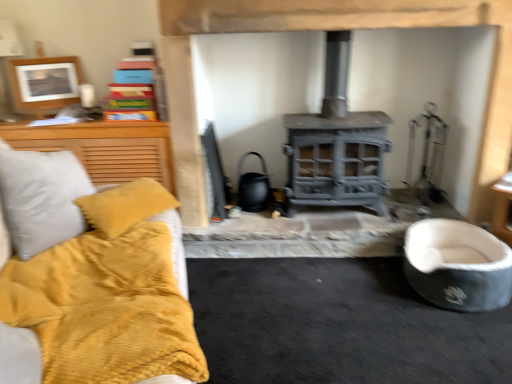
Measure the distance between point (404,1) and camera.

They are 2.08 meters apart.

Measure the distance between point (461,245) and camera.

7.42 feet.

Describe the element at coordinates (45, 83) in the screenshot. I see `wooden picture frame at upper left` at that location.

Image resolution: width=512 pixels, height=384 pixels. I want to click on gray metallic fireplace at center, so click(324, 30).

From the picture: Which point is more distant from viewer, (x=465, y=247) or (x=60, y=94)?

Positioned behind is point (x=60, y=94).

From a real-world perspective, is soft gray fabric pet bed at lower right positioned above or below wooden picture frame at upper left?

From a real-world perspective, soft gray fabric pet bed at lower right is physically below wooden picture frame at upper left.

Is soft gray fabric pet bed at lower right turned away from wooden picture frame at upper left?

soft gray fabric pet bed at lower right is not turned away from wooden picture frame at upper left.

From the image's perspective, is soft gray fabric pet bed at lower right under wooden picture frame at upper left?

Yes, from the image's perspective, soft gray fabric pet bed at lower right is below wooden picture frame at upper left.

Relative to gray metallic fireplace at center, is soft gray fabric pet bed at lower right in front or behind?

Visually, soft gray fabric pet bed at lower right is located in front of gray metallic fireplace at center.

Is soft gray fabric pet bed at lower right located outside gray metallic fireplace at center?

Yes.

Which is closer to the camera, (451,229) or (188,123)?

The point (451,229) is closer.

From a real-world perspective, who is located lower, soft gray fabric pet bed at lower right or gray metallic fireplace at center?

soft gray fabric pet bed at lower right, from a real-world perspective.

The image size is (512, 384). In order to click on fireplace behind the soft gray fabric pet bed at lower right in this screenshot , I will do click(324, 30).

Is gray metallic fireplace at center positioned with its back to soft gray fabric pet bed at lower right?

That's not correct — gray metallic fireplace at center is not looking away from soft gray fabric pet bed at lower right.

From their relative heights in the image, would you say gray metallic fireplace at center is taller or shorter than soft gray fabric pet bed at lower right?

Considering their sizes, gray metallic fireplace at center has more height than soft gray fabric pet bed at lower right.

From a real-world perspective, is gray metallic fireplace at center positioned above or below soft gray fabric pet bed at lower right?

Clearly, from a real-world perspective, gray metallic fireplace at center is above soft gray fabric pet bed at lower right.

Is gray metallic fireplace at center situated inside wooden picture frame at upper left or outside?

The correct answer is: outside.

In terms of size, does gray metallic fireplace at center appear bigger or smaller than wooden picture frame at upper left?

In the image, gray metallic fireplace at center appears to be larger than wooden picture frame at upper left.

From the image's perspective, relative to wooden picture frame at upper left, is gray metallic fireplace at center above or below?

Clearly, from the image's perspective, gray metallic fireplace at center is below wooden picture frame at upper left.

How different are the orientations of gray metallic fireplace at center and wooden picture frame at upper left in degrees?

There is a 27-degree angle between the facing directions of gray metallic fireplace at center and wooden picture frame at upper left.

Considering the relative sizes of wooden picture frame at upper left and soft gray fabric pet bed at lower right in the image provided, is wooden picture frame at upper left taller than soft gray fabric pet bed at lower right?

Yes, wooden picture frame at upper left is taller than soft gray fabric pet bed at lower right.

Is soft gray fabric pet bed at lower right a part of wooden picture frame at upper left?

That's incorrect, soft gray fabric pet bed at lower right is not inside wooden picture frame at upper left.

Is wooden picture frame at upper left bigger or smaller than soft gray fabric pet bed at lower right?

Considering their sizes, wooden picture frame at upper left takes up less space than soft gray fabric pet bed at lower right.

Find the location of `rocking chair lying in front of the wooden picture frame at upper left`. rocking chair lying in front of the wooden picture frame at upper left is located at coordinates (458, 265).

From the image's perspective, which is below, wooden picture frame at upper left or gray metallic fireplace at center?

From the image's view, gray metallic fireplace at center is below.

From the picture: Which of these two, wooden picture frame at upper left or gray metallic fireplace at center, is smaller?

With smaller size is wooden picture frame at upper left.

Is point (74, 65) in front of point (166, 77)?

No, (74, 65) is behind (166, 77).

From a real-world perspective, who is located lower, wooden picture frame at upper left or gray metallic fireplace at center?

gray metallic fireplace at center is physically lower.

Identify the location of rocking chair that is in front of the wooden picture frame at upper left. Image resolution: width=512 pixels, height=384 pixels. (458, 265).

The image size is (512, 384). Find the location of `fireplace above the soft gray fabric pet bed at lower right (from a real-world perspective)`. fireplace above the soft gray fabric pet bed at lower right (from a real-world perspective) is located at coordinates (324, 30).

From the image, which object appears to be nearer to gray metallic fireplace at center, wooden picture frame at upper left or soft gray fabric pet bed at lower right?

Among the two, soft gray fabric pet bed at lower right is located nearer to gray metallic fireplace at center.

Which object lies nearer to the anchor point soft gray fabric pet bed at lower right, wooden picture frame at upper left or gray metallic fireplace at center?

gray metallic fireplace at center is positioned closer to the anchor soft gray fabric pet bed at lower right.

Estimate the real-world distances between objects in this image. Which object is closer to wooden picture frame at upper left, gray metallic fireplace at center or soft gray fabric pet bed at lower right?

gray metallic fireplace at center lies closer to wooden picture frame at upper left than the other object.

Based on their spatial positions, is gray metallic fireplace at center or wooden picture frame at upper left further from soft gray fabric pet bed at lower right?

wooden picture frame at upper left lies further to soft gray fabric pet bed at lower right than the other object.

When comparing their distances from gray metallic fireplace at center, does soft gray fabric pet bed at lower right or wooden picture frame at upper left seem further?

Based on the image, wooden picture frame at upper left appears to be further to gray metallic fireplace at center.

Based on the photo, from the image, which object appears to be farther from wooden picture frame at upper left, soft gray fabric pet bed at lower right or gray metallic fireplace at center?

soft gray fabric pet bed at lower right lies further to wooden picture frame at upper left than the other object.

The image size is (512, 384). I want to click on fireplace between wooden picture frame at upper left and soft gray fabric pet bed at lower right from left to right, so click(324, 30).